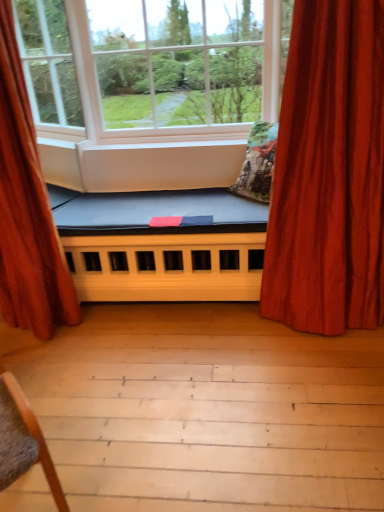
Question: Which direction should I rotate to face white matte window at center, which ranks as the 2th window in left-to-right order, — up or down?

Choices:
 (A) down
 (B) up

Answer: (B)

Question: Considering the relative sizes of textured floral pillow at center and velvet red curtain at right, the 1th curtain when ordered from right to left, in the image provided, is textured floral pillow at center thinner than velvet red curtain at right, the 1th curtain when ordered from right to left,?

Choices:
 (A) no
 (B) yes

Answer: (B)

Question: Are textured floral pillow at center and velvet red curtain at right, the 1th curtain when ordered from right to left, beside each other?

Choices:
 (A) yes
 (B) no

Answer: (B)

Question: Does textured floral pillow at center have a greater height compared to velvet red curtain at right, arranged as the 2th curtain when viewed from the left?

Choices:
 (A) no
 (B) yes

Answer: (A)

Question: Does textured floral pillow at center contain velvet red curtain at right, the 1th curtain when ordered from right to left?

Choices:
 (A) no
 (B) yes

Answer: (A)

Question: Is textured floral pillow at center located outside velvet red curtain at right, arranged as the 2th curtain when viewed from the left?

Choices:
 (A) yes
 (B) no

Answer: (A)

Question: From the image's perspective, is textured floral pillow at center below velvet red curtain at right, the 1th curtain when ordered from right to left?

Choices:
 (A) yes
 (B) no

Answer: (B)

Question: Is textured floral pillow at center positioned behind clear glass window at upper center, which appears as the 2th window when viewed from the right?

Choices:
 (A) yes
 (B) no

Answer: (A)

Question: Can you confirm if textured floral pillow at center is shorter than clear glass window at upper center, arranged as the 1th window when viewed from the left?

Choices:
 (A) yes
 (B) no

Answer: (A)

Question: Is textured floral pillow at center at the right side of clear glass window at upper center, arranged as the 1th window when viewed from the left?

Choices:
 (A) yes
 (B) no

Answer: (A)

Question: From the image's perspective, would you say textured floral pillow at center is shown under clear glass window at upper center, arranged as the 1th window when viewed from the left?

Choices:
 (A) no
 (B) yes

Answer: (B)

Question: Is textured floral pillow at center smaller than clear glass window at upper center, which appears as the 2th window when viewed from the right?

Choices:
 (A) no
 (B) yes

Answer: (A)

Question: Considering the relative positions of textured floral pillow at center and clear glass window at upper center, which appears as the 2th window when viewed from the right, in the image provided, is textured floral pillow at center to the left of clear glass window at upper center, which appears as the 2th window when viewed from the right, from the viewer's perspective?

Choices:
 (A) no
 (B) yes

Answer: (A)

Question: Is velvet red curtain at left, which is the 2th curtain in right-to-left order, wider than blue fabric futon at center?

Choices:
 (A) yes
 (B) no

Answer: (B)